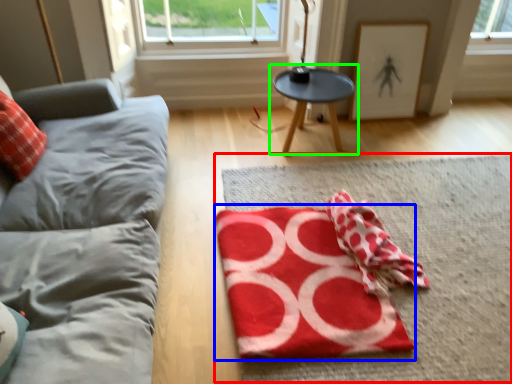
Question: Estimate the real-world distances between objects in this image. Which object is closer to mat (highlighted by a red box), yoga mat (highlighted by a blue box) or table (highlighted by a green box)?

Choices:
 (A) yoga mat
 (B) table

Answer: (A)